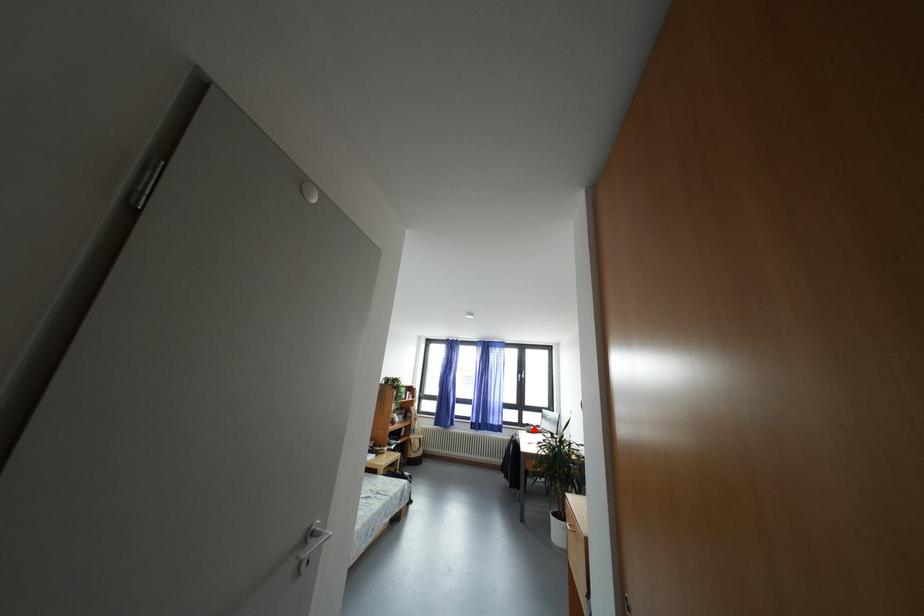
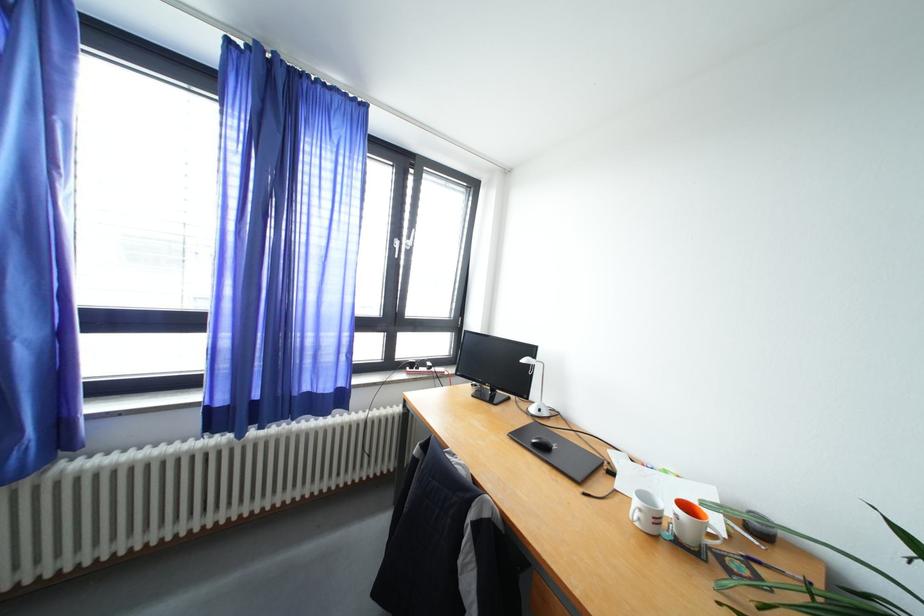
Question: I am providing you with two images of the same scene from different viewpoints. A red point is shown in image1. For the corresponding object point in image2, is it positioned nearer or farther from the camera?

Choices:
 (A) Nearer
 (B) Farther

Answer: (A)